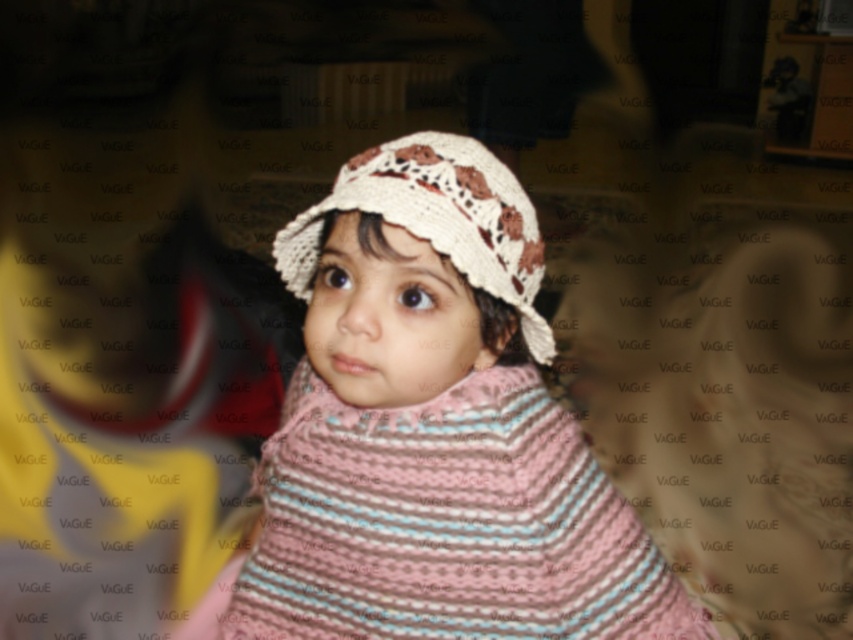
Describe the element at coordinates (432, 433) in the screenshot. I see `white knitted hat at center` at that location.

Can you confirm if white knitted hat at center is positioned below crochet beige hat at center?

Correct, white knitted hat at center is located below crochet beige hat at center.

Locate an element on the screen. Image resolution: width=853 pixels, height=640 pixels. white knitted hat at center is located at coordinates (432, 433).